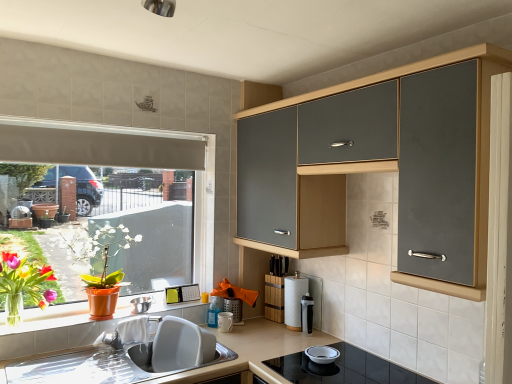
Question: From their relative heights in the image, would you say metallic mesh container at center, which is the 4th appliance from left to right, is taller or shorter than white matte exhaust hood at upper left?

Choices:
 (A) tall
 (B) short

Answer: (B)

Question: Considering the positions of point (224, 299) and point (98, 142), is point (224, 299) closer or farther from the camera than point (98, 142)?

Choices:
 (A) closer
 (B) farther

Answer: (B)

Question: Which object is positioned farthest from the beige matte countertop at lower center?

Choices:
 (A) matte orange pot at left
 (B) vivid floral bouquet at left
 (C) matte gray cabinet at upper right
 (D) orange plastic at lower left
 (E) translucent plastic bottle at upper center, positioned as the 5th appliance in right-to-left order

Answer: (C)

Question: Which of these objects is positioned closest to the translucent plastic bottle at upper center, which appears as the 2th appliance when viewed from the left?

Choices:
 (A) matte gray cabinet at upper right
 (B) white paper towel at center, which is counted as the second appliance, starting from the right
 (C) white matte exhaust hood at upper left
 (D) matte orange pot at left
 (E) white plastic sink at lower left

Answer: (E)